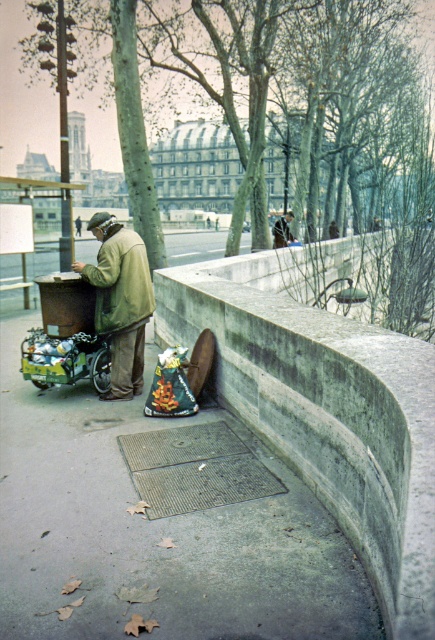
Based on the photo, you are a pedestrian walking on the sidewalk and see the light brown leather jacket at upper center and the concrete ledge at lower center. Which object is closer to your left side?

The concrete ledge at lower center is to the left of the light brown leather jacket at upper center, so the concrete ledge at lower center is closer to your left side.

From the picture: You are a delivery person trying to place a large package on the concrete ledge at lower center. The package is as wide as the light brown leather jacket at upper center. Will the package fit on the ledge?

The concrete ledge at lower center is wider than the light brown leather jacket at upper center, so the package will fit since its width matches the jacket.